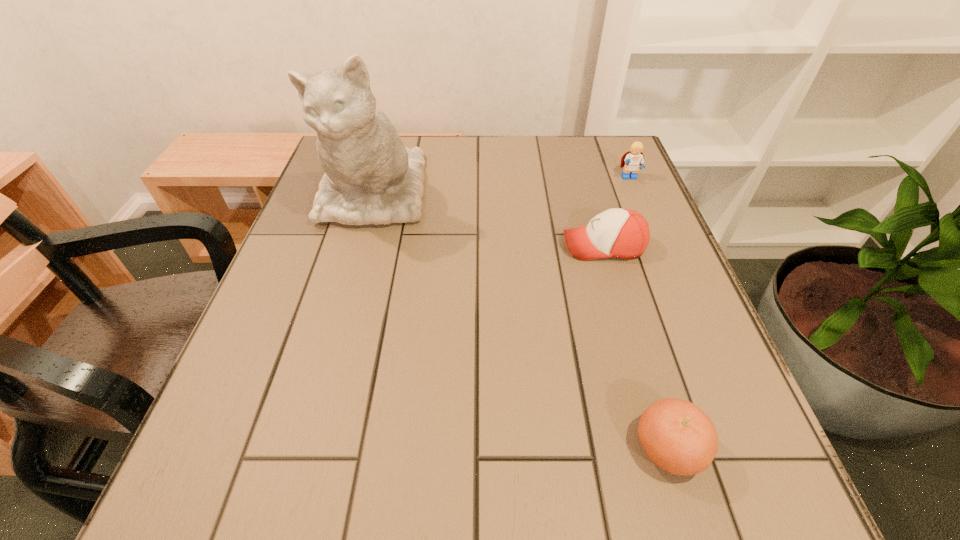
What are the coordinates of `vacant area in the image that satisfies the following two spatial constraints: 1. on the front-facing side of the clementine; 2. on the left side of the cat` in the screenshot? It's located at (301, 448).

Find the location of a particular element. blank area in the image that satisfies the following two spatial constraints: 1. on the front-facing side of the Lego; 2. on the front-facing side of the baseball cap is located at coordinates (658, 246).

This screenshot has width=960, height=540. I want to click on vacant point that satisfies the following two spatial constraints: 1. on the front-facing side of the cat; 2. on the left side of the nearest object, so click(x=301, y=448).